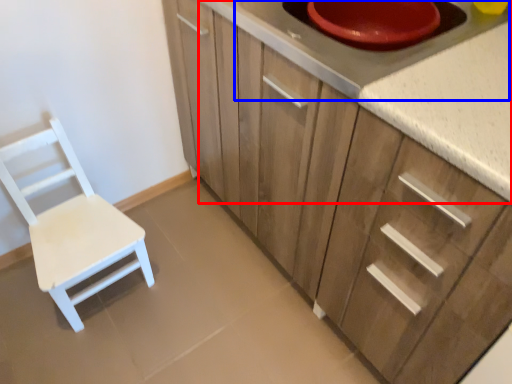
Question: Among these objects, which one is nearest to the camera, countertop (highlighted by a red box) or appliance (highlighted by a blue box)?

Choices:
 (A) countertop
 (B) appliance

Answer: (A)